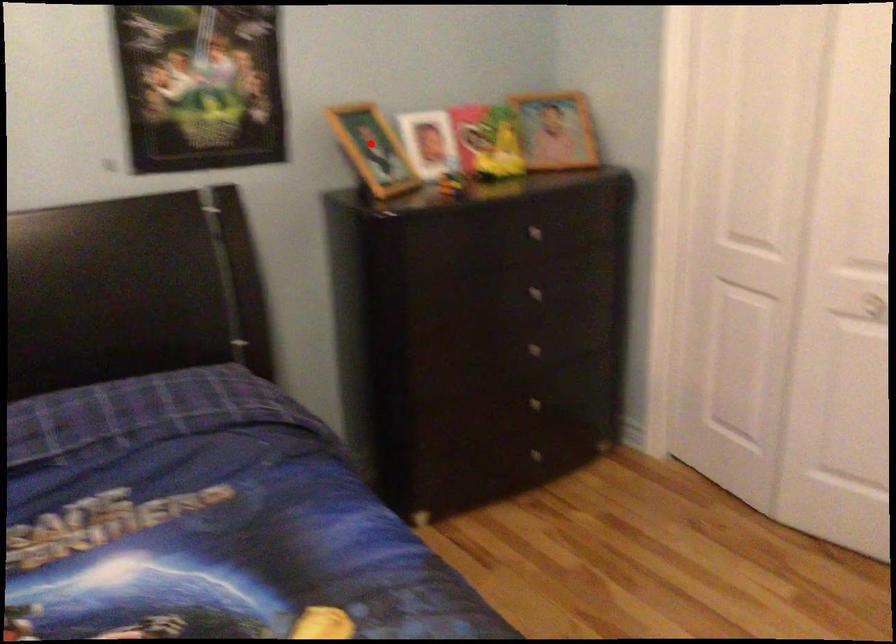
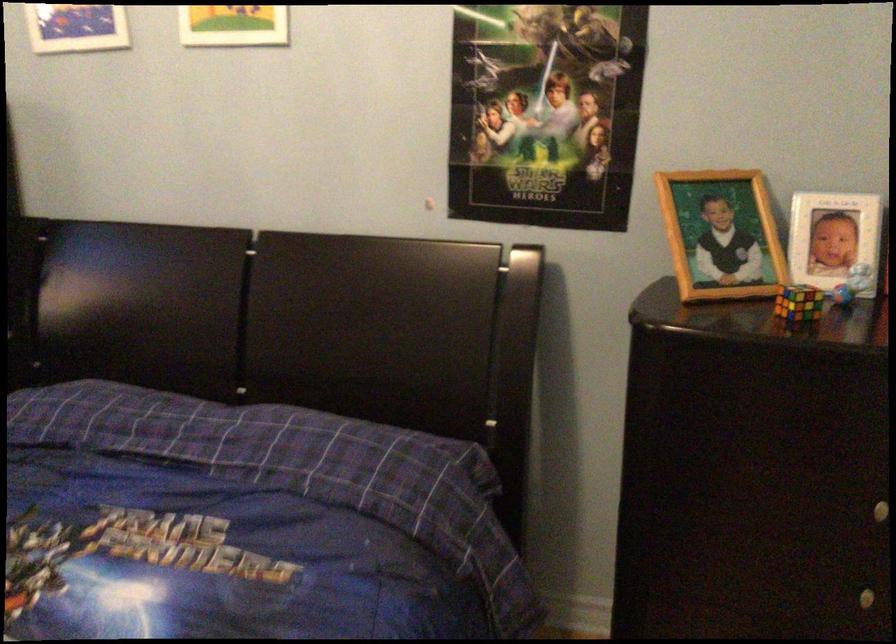
Question: A red point is marked in image1. In image2, is the corresponding 3D point closer to the camera or farther? Reply with the corresponding letter.

Choices:
 (A) The corresponding 3D point is closer.
 (B) The corresponding 3D point is farther.

Answer: (A)